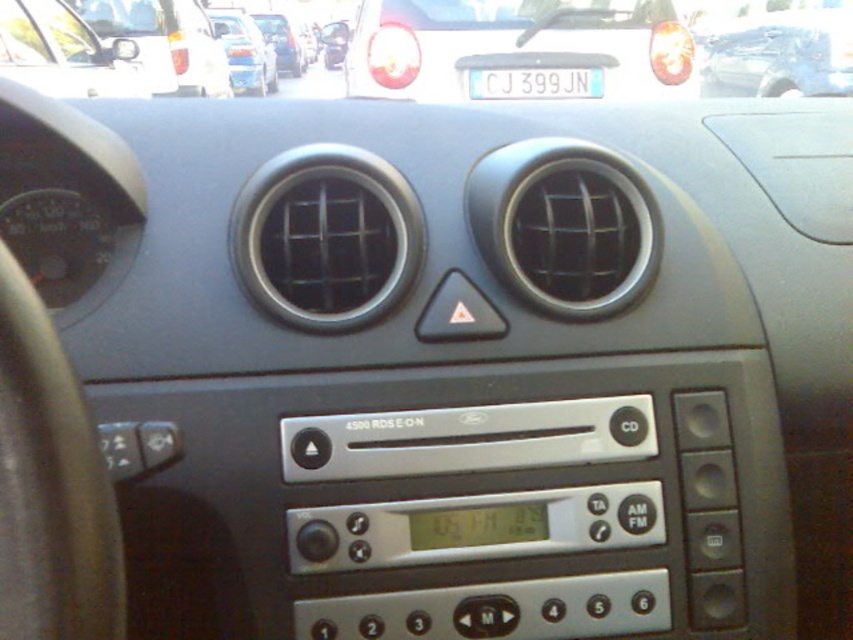
You are a driver checking the rearview mirror in your car. You notice the metallic silver side mirror at upper left and the matte black car at center in your view. Which object takes up more space in your field of view?

The matte black car at center occupies more space in the field of view than the metallic silver side mirror at upper left, as the metallic silver side mirror at upper left occupies less space than matte black car at center.

You are a car mechanic checking the dashboard. You need to determine which object is narrower between the metallic silver side mirror at upper left and the white plastic license plate at center. Which one is narrower?

The metallic silver side mirror at upper left is narrower than the white plastic license plate at center.

You are a passenger in the matte silver car at upper left and want to exit the car. Is the matte black car at center blocking your door?

The matte silver car at upper left is much taller than the matte black car at center, so the matte black car at center is smaller and less likely to block the door of the matte silver car at upper left.